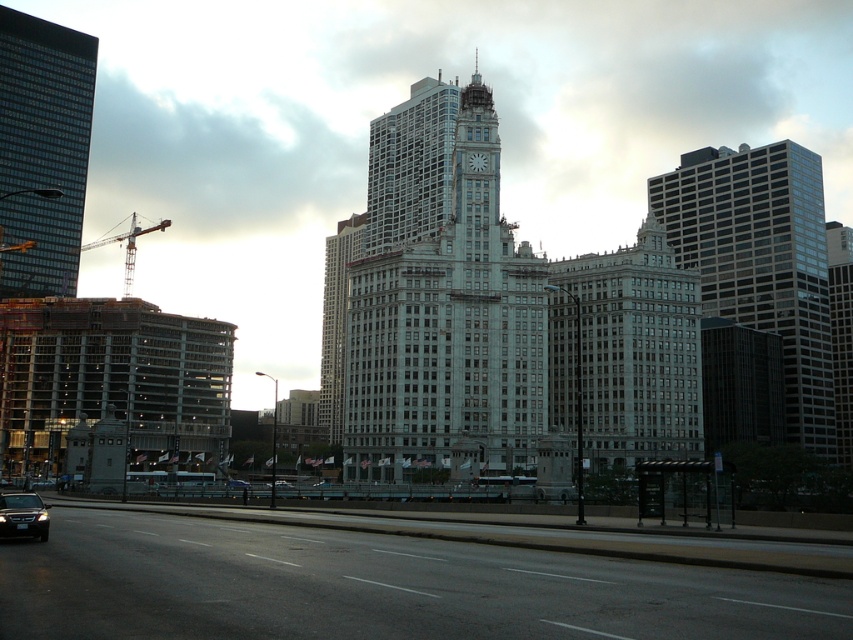
Does gray glass building at center appear on the right side of glass skyscraper at left?

Indeed, gray glass building at center is positioned on the right side of glass skyscraper at left.

Find the location of `gray glass building at center`. gray glass building at center is located at coordinates (625, 353).

Is point (628, 342) closer to camera compared to point (61, 38)?

Yes.

You are a GUI agent. You are given a task and a screenshot of the screen. Output one action in this format:
    pyautogui.click(x=<x>, y=<y>)
    Task: Click on the gray glass building at center
    
    Given the screenshot: What is the action you would take?
    pyautogui.click(x=625, y=353)

Does point (498, 461) lie behind point (32, 144)?

No, it is in front of (32, 144).

Is the position of white stone clock tower at center more distant than that of glass skyscraper at left?

No, it is in front of glass skyscraper at left.

I want to click on white stone clock tower at center, so click(440, 301).

Who is taller, black asphalt highway at lower center or white stone clock tower at center?

With more height is white stone clock tower at center.

Image resolution: width=853 pixels, height=640 pixels. Describe the element at coordinates (375, 588) in the screenshot. I see `black asphalt highway at lower center` at that location.

Between point (199, 573) and point (392, 275), which one is positioned in front?

Positioned in front is point (199, 573).

The width and height of the screenshot is (853, 640). Identify the location of black asphalt highway at lower center. (375, 588).